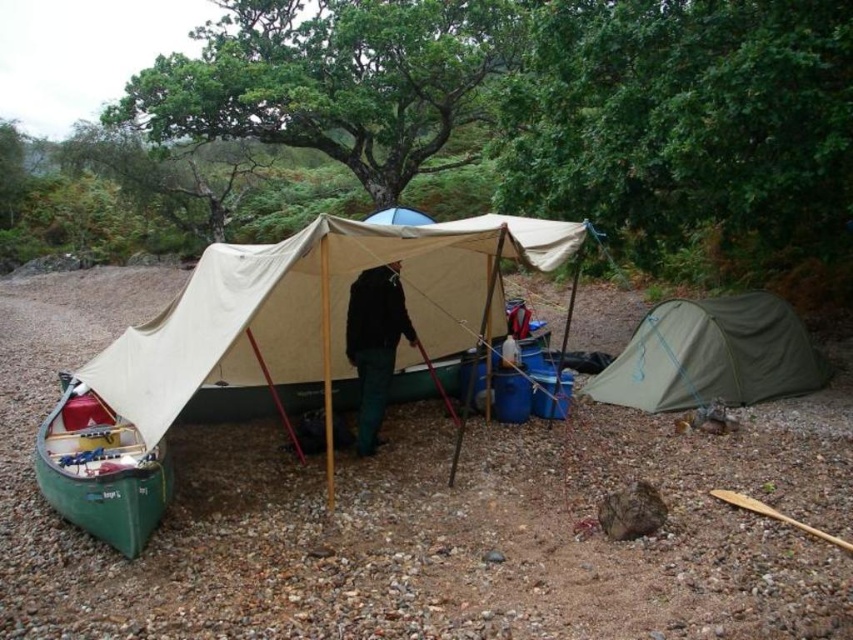
Can you confirm if beige canvas tarp at center is thinner than green fabric tent at lower right?

Yes, beige canvas tarp at center is thinner than green fabric tent at lower right.

Between beige canvas tarp at center and green fabric tent at lower right, which one has less height?

beige canvas tarp at center is shorter.

Is point (310, 380) more distant than point (712, 392)?

Yes, point (310, 380) is behind point (712, 392).

In order to click on beige canvas tarp at center in this screenshot , I will do `click(306, 316)`.

Measure the distance between green fabric tent at lower right and green matte canoe at lower left.

green fabric tent at lower right and green matte canoe at lower left are 18.95 feet apart from each other.

Which is below, green fabric tent at lower right or green matte canoe at lower left?

green matte canoe at lower left is below.

Is point (701, 364) in front of point (79, 486)?

That is False.

Where is `green fabric tent at lower right`? The height and width of the screenshot is (640, 853). green fabric tent at lower right is located at coordinates (711, 355).

Does green matte canoe at lower left appear over black fabric jacket at center?

No, green matte canoe at lower left is not above black fabric jacket at center.

Is green matte canoe at lower left bigger than black fabric jacket at center?

Indeed, green matte canoe at lower left has a larger size compared to black fabric jacket at center.

Which is behind, point (96, 458) or point (373, 349)?

Point (373, 349)

Find the location of a particular element. green matte canoe at lower left is located at coordinates (100, 470).